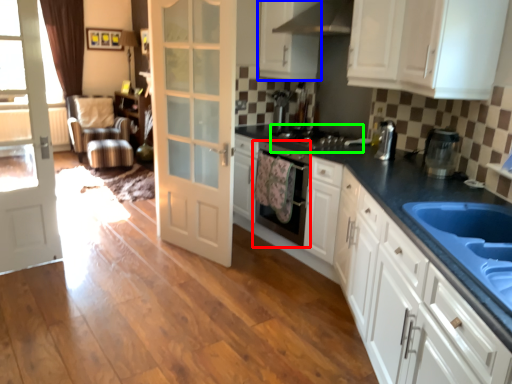
Question: Which object is positioned closest to dish washer (highlighted by a red box)? Select from cabinetry (highlighted by a blue box) and appliance (highlighted by a green box).

Choices:
 (A) cabinetry
 (B) appliance

Answer: (B)